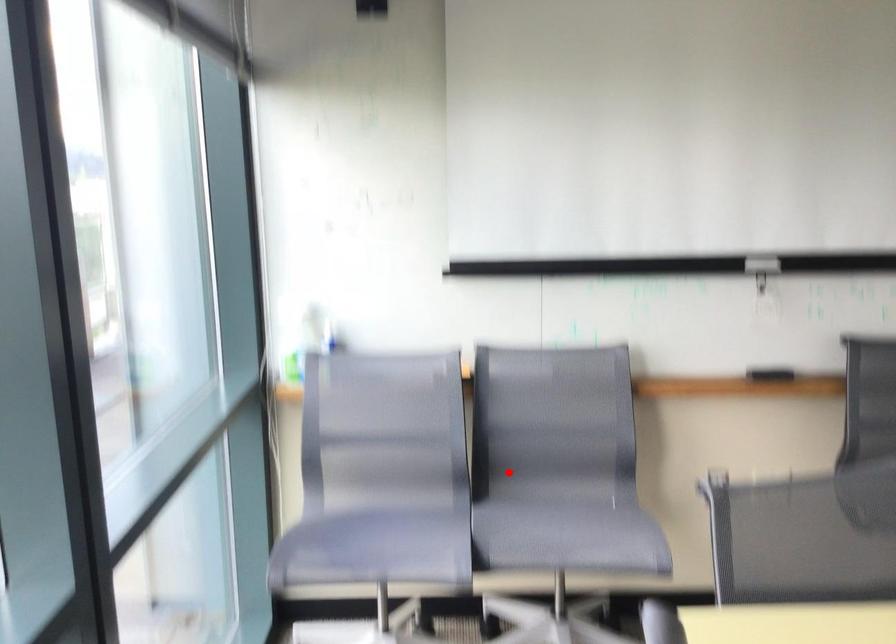
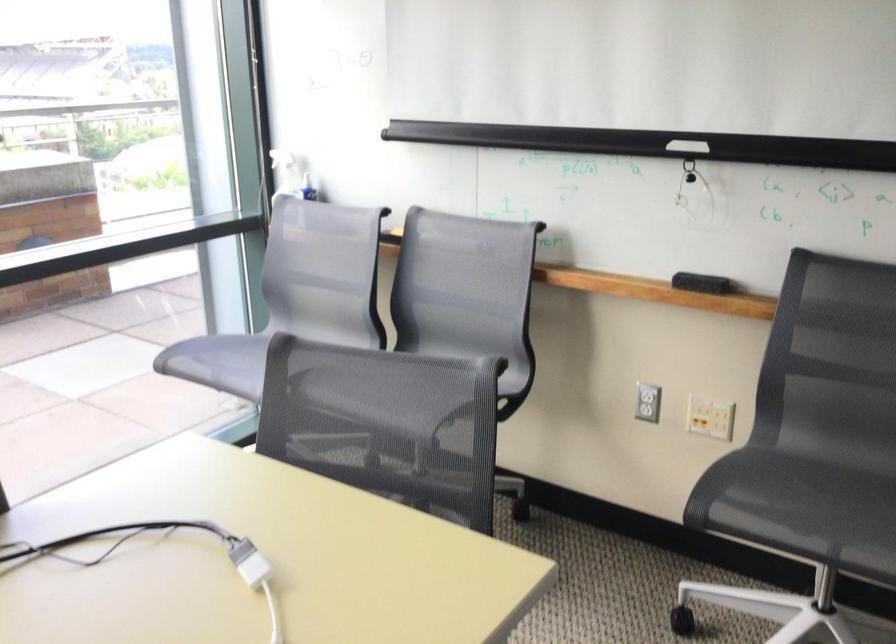
Find the pixel in the second image that matches the highlighted location in the first image.

(426, 337)